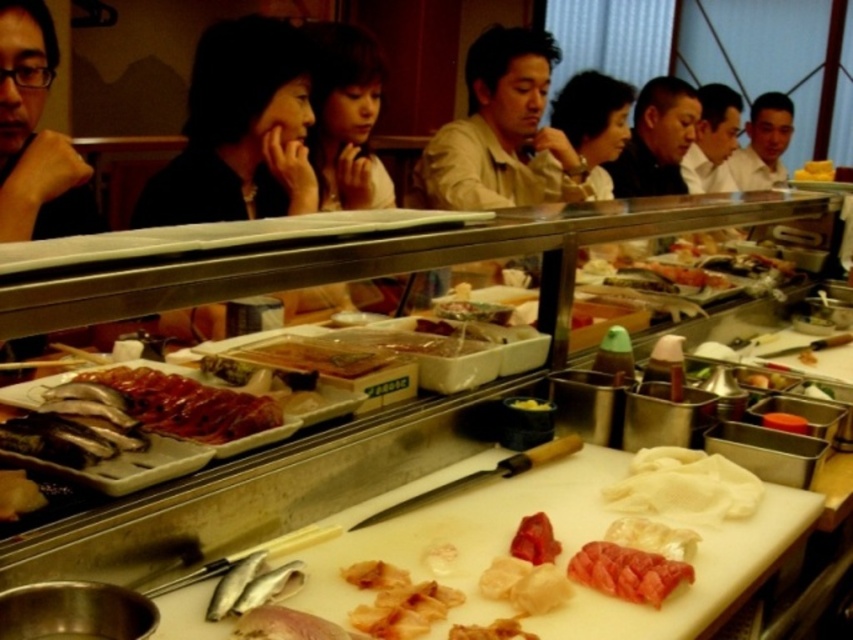
You are a customer sitting at the sushi bar and want to point out two specific points on the counter to the chef. The first point is at coordinate point(x=613, y=157) and the second is at point(x=726, y=163). Which point is closer to you?

Point(x=613, y=157) is closer to you because it is in front of point(x=726, y=163).

You are a photographer trying to capture the reflection of the smooth skin face at center and the light brown shirt at upper right in a mirror placed on the counter. Which object will have a narrower reflection in the mirror?

The smooth skin face at center will have a narrower reflection in the mirror because it is thinner than the light brown shirt at upper right.

In the scene shown: You are a photographer standing at the sushi bar counter. You want to take a closeup photo of the smooth skin face at center. The camera you are using has a minimum focusing distance of 2 meters. Can you take the photo without moving closer?

The distance between the smooth skin face at center and the camera is 2.76 meters, which is greater than the minimum focusing distance of 2 meters. Therefore, you can take the closeup photo without moving closer.